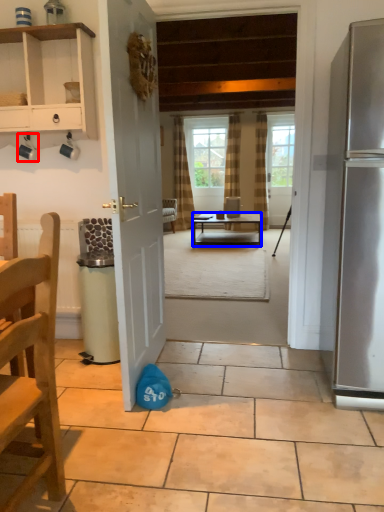
Question: Among these objects, which one is farthest to the camera, coffee cup (highlighted by a red box) or desk (highlighted by a blue box)?

Choices:
 (A) coffee cup
 (B) desk

Answer: (B)